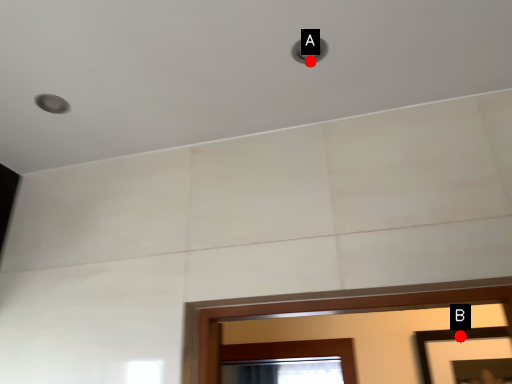
Question: Two points are circled on the image, labeled by A and B beside each circle. Which point is closer to the camera taking this photo?

Choices:
 (A) A is closer
 (B) B is closer

Answer: (A)